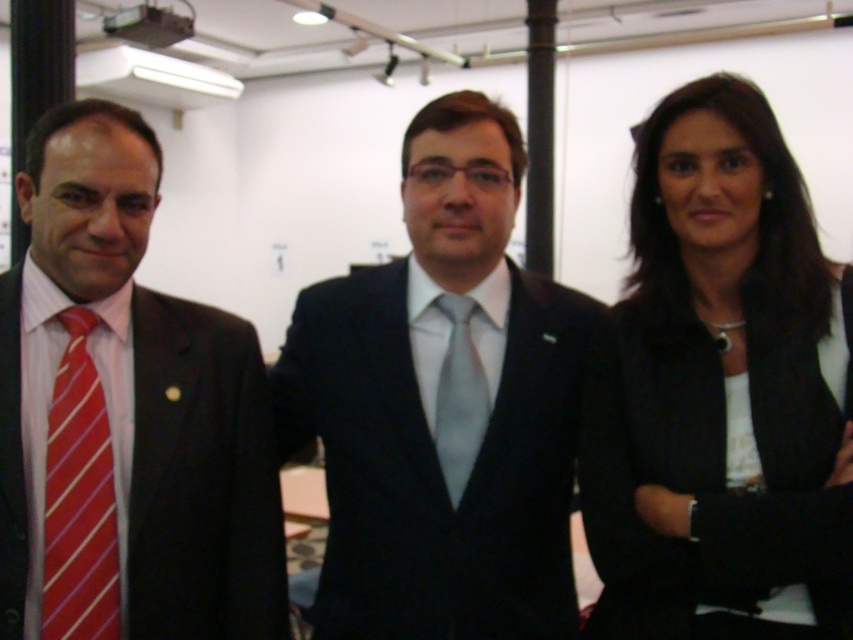
You are a photographer at a formal event. You need to arrange the two subjects so that the matte black suit at left and the light gray silk tie at center are visible in the frame. Based on their current positions, which subject is positioned to the left of the other?

The matte black suit at left is positioned to the left of the light gray silk tie at center.

You are standing at the point labeled point (840, 397). You want to take a photo of the camera. Is the camera within your 10 feet?

The camera is 3.95 feet away from point (840, 397), so yes, the camera is within 10 feet.

You are standing in a room with two points marked on the wall. The first point is at coordinates point (13, 506) and the second point is at coordinates point (479, 371). Which point is closer to you?

Point (13, 506) is closer to the viewer than point (479, 371).